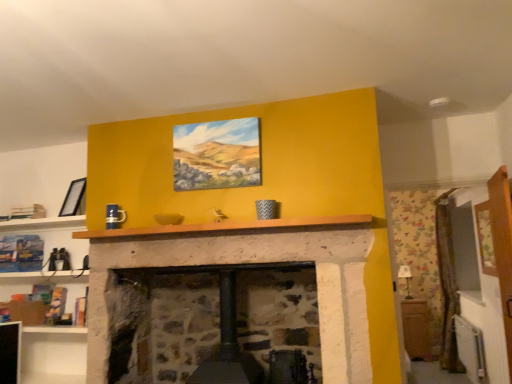
Image resolution: width=512 pixels, height=384 pixels. In order to click on wooden cabinet at right in this screenshot , I will do [416, 329].

In order to face matte canvas painting at center, which is counted as the second picture frame, starting from the back, should I rotate leftwards or rightwards?

You should look left and rotate roughly 5.608 degrees.

Where is `matte canvas painting at center, arranged as the second picture frame when viewed from the left`? The image size is (512, 384). matte canvas painting at center, arranged as the second picture frame when viewed from the left is located at coordinates 217,154.

Image resolution: width=512 pixels, height=384 pixels. Describe the element at coordinates (226, 226) in the screenshot. I see `wooden mantle at center` at that location.

Locate an element on the screen. matte black picture frame at upper left, which is the 1th picture frame in back-to-front order is located at coordinates (73, 198).

Is matte black picture frame at upper left, the 2th picture frame in the front-to-back sequence, positioned with its back to wooden mantle at center?

That's not correct — matte black picture frame at upper left, the 2th picture frame in the front-to-back sequence, is not looking away from wooden mantle at center.

Based on the photo, is matte black picture frame at upper left, marked as the 1th picture frame in a left-to-right arrangement, bigger than wooden mantle at center?

Actually, matte black picture frame at upper left, marked as the 1th picture frame in a left-to-right arrangement, might be smaller than wooden mantle at center.

Identify the location of mantle below the matte black picture frame at upper left, acting as the second picture frame starting from the right (from the image's perspective). coord(226,226).

From a real-world perspective, which object stands above the other?

From a 3D spatial view, matte black picture frame at upper left, the 2th picture frame in the front-to-back sequence, is above.

Is wooden cabinet at right positioned far away from matte canvas painting at center, the first picture frame in the front-to-back sequence?

That's right, there is a large distance between wooden cabinet at right and matte canvas painting at center, the first picture frame in the front-to-back sequence.

From a real-world perspective, is wooden cabinet at right over matte canvas painting at center, the first picture frame in the front-to-back sequence?

No, from a real-world perspective, wooden cabinet at right is not over matte canvas painting at center, the first picture frame in the front-to-back sequence

What's the angular difference between wooden cabinet at right and matte canvas painting at center, the first picture frame in the front-to-back sequence,'s facing directions?

wooden cabinet at right and matte canvas painting at center, the first picture frame in the front-to-back sequence, are facing 1.18 degrees away from each other.

From the wooden cabinet at right, count the 1st picture frame to the left and point to it. Please provide its 2D coordinates.

[(217, 154)]

In the scene shown: Is matte black picture frame at upper left, marked as the 1th picture frame in a left-to-right arrangement, to the right of wooden cabinet at right from the viewer's perspective?

Incorrect, matte black picture frame at upper left, marked as the 1th picture frame in a left-to-right arrangement, is not on the right side of wooden cabinet at right.

From a real-world perspective, is matte black picture frame at upper left, marked as the 1th picture frame in a left-to-right arrangement, on wooden cabinet at right?

Indeed, from a real-world perspective, matte black picture frame at upper left, marked as the 1th picture frame in a left-to-right arrangement, stands above wooden cabinet at right.

Is point (85, 177) closer or farther from the camera than point (405, 302)?

Point (85, 177) is positioned farther from the camera compared to point (405, 302).

How much distance is there between matte canvas painting at center, which is counted as the second picture frame, starting from the back, and wooden cabinet at right?

matte canvas painting at center, which is counted as the second picture frame, starting from the back, and wooden cabinet at right are 1.83 meters apart from each other.

Based on the photo, is wooden cabinet at right at the back of matte canvas painting at center, the first picture frame in the front-to-back sequence?

No.

Which is in front, matte canvas painting at center, which is counted as the second picture frame, starting from the back, or wooden cabinet at right?

matte canvas painting at center, which is counted as the second picture frame, starting from the back, is in front.

Looking at this image, considering the positions of objects matte canvas painting at center, the first picture frame in the front-to-back sequence, and wooden cabinet at right in the image provided, who is more to the left, matte canvas painting at center, the first picture frame in the front-to-back sequence, or wooden cabinet at right?

Positioned to the left is matte canvas painting at center, the first picture frame in the front-to-back sequence.

Image resolution: width=512 pixels, height=384 pixels. In the image, there is a matte canvas painting at center, arranged as the second picture frame when viewed from the left. Find the location of `picture frame below it (from the image's perspective)`. picture frame below it (from the image's perspective) is located at coordinates (73, 198).

Considering the sizes of objects matte canvas painting at center, the first picture frame viewed from the right, and matte black picture frame at upper left, acting as the second picture frame starting from the right, in the image provided, who is shorter, matte canvas painting at center, the first picture frame viewed from the right, or matte black picture frame at upper left, acting as the second picture frame starting from the right,?

matte black picture frame at upper left, acting as the second picture frame starting from the right.

Which object is further away from the camera, matte canvas painting at center, the first picture frame in the front-to-back sequence, or matte black picture frame at upper left, marked as the 1th picture frame in a left-to-right arrangement?

Positioned behind is matte black picture frame at upper left, marked as the 1th picture frame in a left-to-right arrangement.

Can you confirm if wooden mantle at center is taller than matte canvas painting at center, the first picture frame viewed from the right?

In fact, wooden mantle at center may be shorter than matte canvas painting at center, the first picture frame viewed from the right.

Is wooden mantle at center located outside matte canvas painting at center, arranged as the second picture frame when viewed from the left?

wooden mantle at center is positioned outside matte canvas painting at center, arranged as the second picture frame when viewed from the left.

From a real-world perspective, which is physically above, wooden mantle at center or matte canvas painting at center, which is counted as the second picture frame, starting from the back?

matte canvas painting at center, which is counted as the second picture frame, starting from the back, from a real-world perspective.

Between wooden cabinet at right and wooden mantle at center, which one has smaller width?

With smaller width is wooden mantle at center.

From the image's perspective, is wooden cabinet at right on wooden mantle at center?

Incorrect, from the image's perspective, wooden cabinet at right is lower than wooden mantle at center.

From a real-world perspective, is wooden cabinet at right under wooden mantle at center?

Yes, from a real-world perspective, wooden cabinet at right is under wooden mantle at center.

Does wooden cabinet at right turn towards wooden mantle at center?

No, wooden cabinet at right is not aimed at wooden mantle at center.

I want to click on mantle in front of the matte black picture frame at upper left, marked as the 1th picture frame in a left-to-right arrangement, so click(x=226, y=226).

You are a GUI agent. You are given a task and a screenshot of the screen. Output one action in this format:
    pyautogui.click(x=<x>, y=<y>)
    Task: Click on the 2nd picture frame above the wooden cabinet at right (from the image's perspective)
    
    Given the screenshot: What is the action you would take?
    pyautogui.click(x=217, y=154)

Looking at the image, which one is located closer to matte black picture frame at upper left, acting as the second picture frame starting from the right, wooden mantle at center or matte canvas painting at center, arranged as the second picture frame when viewed from the left?

wooden mantle at center is positioned closer to the anchor matte black picture frame at upper left, acting as the second picture frame starting from the right.

From the image, which object appears to be farther from wooden mantle at center, wooden cabinet at right or matte black picture frame at upper left, the 2th picture frame in the front-to-back sequence?

Among the two, wooden cabinet at right is located further to wooden mantle at center.

When comparing their distances from matte black picture frame at upper left, marked as the 1th picture frame in a left-to-right arrangement, does matte canvas painting at center, the first picture frame viewed from the right, or wooden cabinet at right seem closer?

matte canvas painting at center, the first picture frame viewed from the right, is closer to matte black picture frame at upper left, marked as the 1th picture frame in a left-to-right arrangement.

Considering their positions, is matte canvas painting at center, arranged as the second picture frame when viewed from the left, positioned further to wooden mantle at center than wooden cabinet at right?

wooden cabinet at right is further to wooden mantle at center.

Estimate the real-world distances between objects in this image. Which object is closer to wooden mantle at center, matte black picture frame at upper left, marked as the 1th picture frame in a left-to-right arrangement, or matte canvas painting at center, the first picture frame viewed from the right?

Based on the image, matte canvas painting at center, the first picture frame viewed from the right, appears to be nearer to wooden mantle at center.

Looking at the image, which one is located closer to matte canvas painting at center, arranged as the second picture frame when viewed from the left, matte black picture frame at upper left, which is the 1th picture frame in back-to-front order, or wooden cabinet at right?

Among the two, matte black picture frame at upper left, which is the 1th picture frame in back-to-front order, is located nearer to matte canvas painting at center, arranged as the second picture frame when viewed from the left.

Which object lies further to the anchor point wooden mantle at center, matte black picture frame at upper left, which is the 1th picture frame in back-to-front order, or wooden cabinet at right?

Among the two, wooden cabinet at right is located further to wooden mantle at center.

Looking at the image, which one is located closer to matte canvas painting at center, arranged as the second picture frame when viewed from the left, matte black picture frame at upper left, acting as the second picture frame starting from the right, or wooden mantle at center?

The object closer to matte canvas painting at center, arranged as the second picture frame when viewed from the left, is wooden mantle at center.

Locate an element on the screen. The image size is (512, 384). mantle situated between matte black picture frame at upper left, marked as the 1th picture frame in a left-to-right arrangement, and wooden cabinet at right from left to right is located at coordinates (226, 226).

The width and height of the screenshot is (512, 384). In order to click on picture frame between matte black picture frame at upper left, acting as the second picture frame starting from the right, and wooden mantle at center from left to right in this screenshot , I will do `click(217, 154)`.

Image resolution: width=512 pixels, height=384 pixels. In order to click on picture frame between matte black picture frame at upper left, which is the 1th picture frame in back-to-front order, and wooden cabinet at right, in the horizontal direction in this screenshot , I will do `click(217, 154)`.